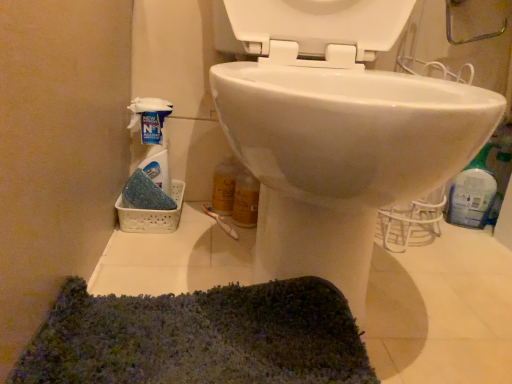
I want to click on vacant area that is in front of blue plastic bottle at right, which is counted as the 1th cleaning product, starting from the right, so click(474, 246).